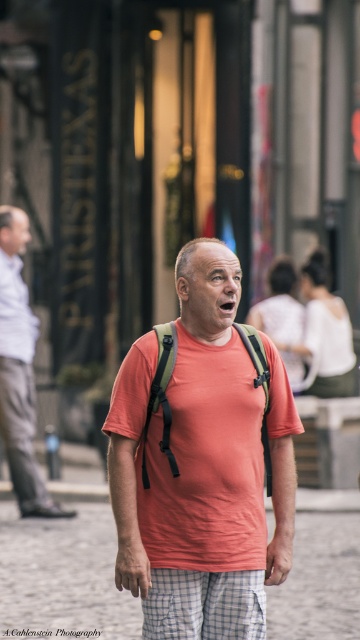
Can you confirm if matte white shirt at center is thinner than white checkered shorts at center?

No, matte white shirt at center is not thinner than white checkered shorts at center.

Can you confirm if matte white shirt at center is positioned above white checkered shorts at center?

Correct, matte white shirt at center is located above white checkered shorts at center.

Find the location of a particular element. matte white shirt at center is located at coordinates (19, 371).

I want to click on matte white shirt at center, so click(19, 371).

Is matte orange t-shirt at center bigger than white checkered shorts at center?

Yes, matte orange t-shirt at center is bigger than white checkered shorts at center.

Is point (253, 476) positioned after point (165, 604)?

Yes, point (253, 476) is farther from viewer.

Image resolution: width=360 pixels, height=640 pixels. In order to click on matte orange t-shirt at center in this screenshot , I will do `click(201, 465)`.

Does matte orange t-shirt at center lie behind white stone pavement at lower center?

No, it is in front of white stone pavement at lower center.

Who is positioned more to the left, matte orange t-shirt at center or white stone pavement at lower center?

white stone pavement at lower center

Is point (227, 307) behind point (344, 614)?

No, (227, 307) is in front of (344, 614).

Where is `matte orange t-shirt at center`? The height and width of the screenshot is (640, 360). matte orange t-shirt at center is located at coordinates (201, 465).